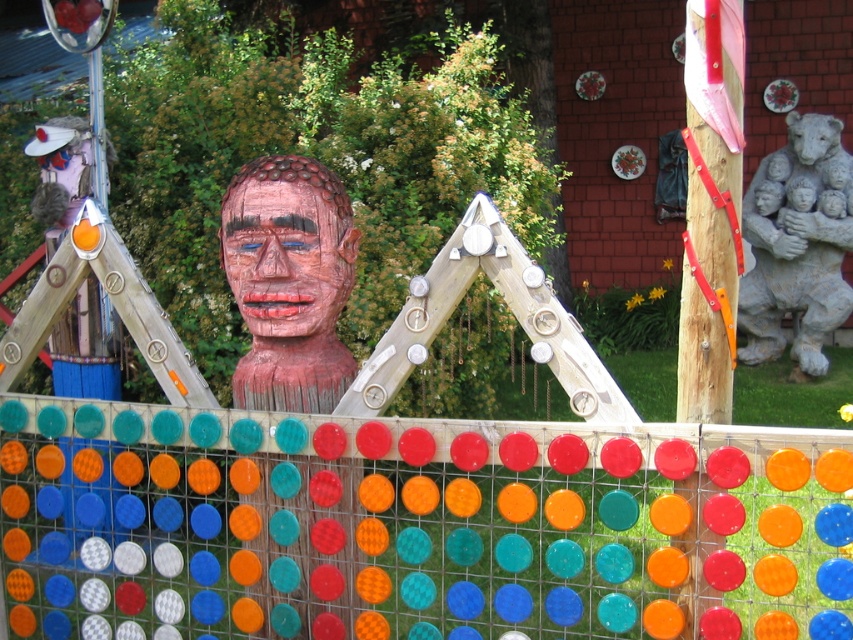
Question: Which object is positioned closest to the gray stone bear at right?

Choices:
 (A) wooden head at center
 (B) wooden mask at center

Answer: (A)

Question: Which object is positioned farthest from the wooden head at center?

Choices:
 (A) wooden mask at center
 (B) gray stone bear at right

Answer: (B)

Question: Is wooden head at center thinner than gray stone bear at right?

Choices:
 (A) yes
 (B) no

Answer: (A)

Question: Which point is closer to the camera?

Choices:
 (A) wooden head at center
 (B) wooden mask at center
 (C) gray stone bear at right

Answer: (B)

Question: Does gray stone bear at right have a greater width compared to wooden mask at center?

Choices:
 (A) yes
 (B) no

Answer: (A)

Question: From the image, what is the correct spatial relationship of wooden head at center in relation to wooden mask at center?

Choices:
 (A) right
 (B) left

Answer: (B)